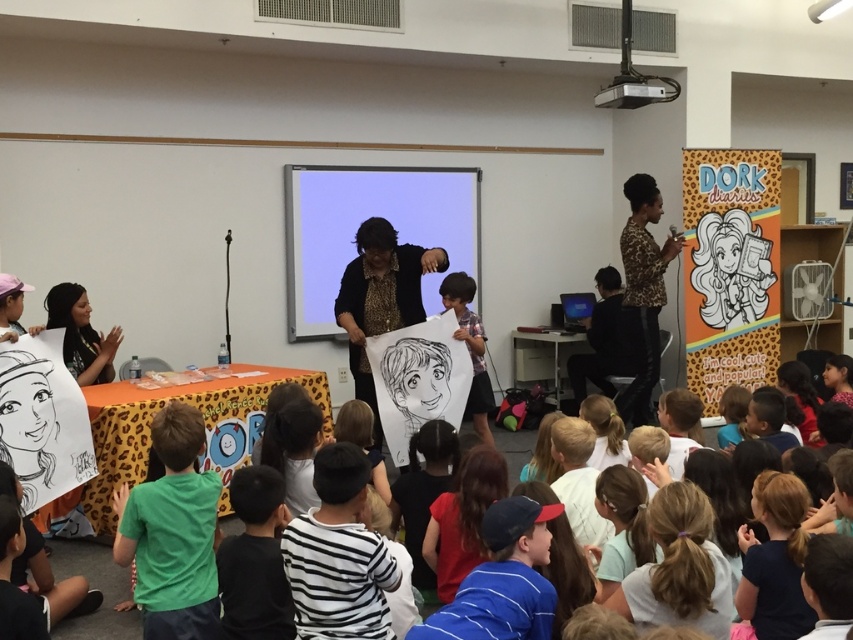
Can you confirm if green matte shirt at lower left is bigger than matte white paper at center?

Incorrect, green matte shirt at lower left is not larger than matte white paper at center.

Which is more to the right, green matte shirt at lower left or matte white paper at center?

From the viewer's perspective, matte white paper at center appears more on the right side.

Where is `green matte shirt at lower left`? This screenshot has height=640, width=853. green matte shirt at lower left is located at coordinates (172, 532).

Does matte black board at center appear over green matte shirt at lower left?

Indeed, matte black board at center is positioned over green matte shirt at lower left.

The height and width of the screenshot is (640, 853). Describe the element at coordinates (363, 220) in the screenshot. I see `matte black board at center` at that location.

This screenshot has height=640, width=853. Find the location of `matte black board at center`. matte black board at center is located at coordinates (363, 220).

Is leopard print jacket at upper right behind matte white paper at center?

Yes, leopard print jacket at upper right is behind matte white paper at center.

Measure the distance between point [640,403] and camera.

Point [640,403] and camera are 6.15 meters apart from each other.

Locate an element on the screen. leopard print jacket at upper right is located at coordinates (642, 292).